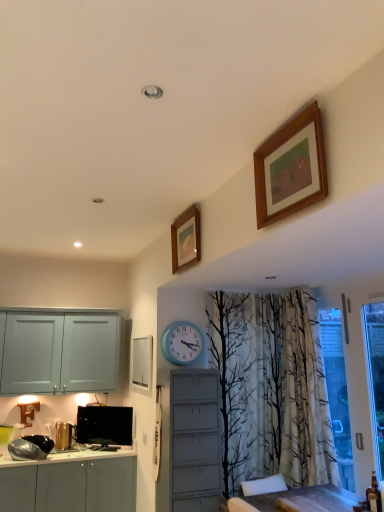
This screenshot has height=512, width=384. What are the coordinates of `free spot above wooden picture frame at upper center, which appears as the second picture frame when viewed from the right (from a real-world perspective)` in the screenshot? It's located at coord(182,213).